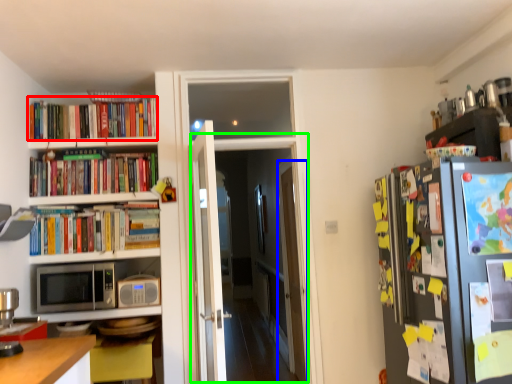
Question: Which object is the farthest from book (highlighted by a red box)? Choose among these: glass door (highlighted by a blue box) or glass door (highlighted by a green box).

Choices:
 (A) glass door
 (B) glass door

Answer: (B)